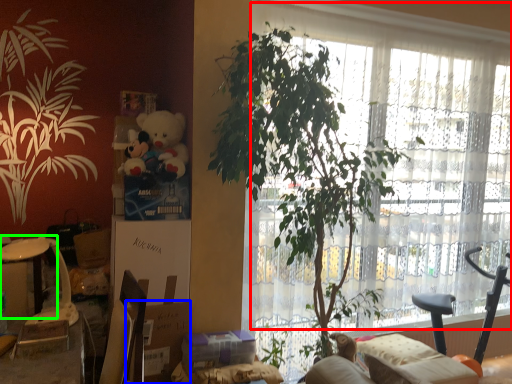
Question: Based on their relative distances, which object is nearer to window frame (highlighted by a red box)? Choose from cardboard box (highlighted by a blue box) and table (highlighted by a green box).

Choices:
 (A) cardboard box
 (B) table

Answer: (A)